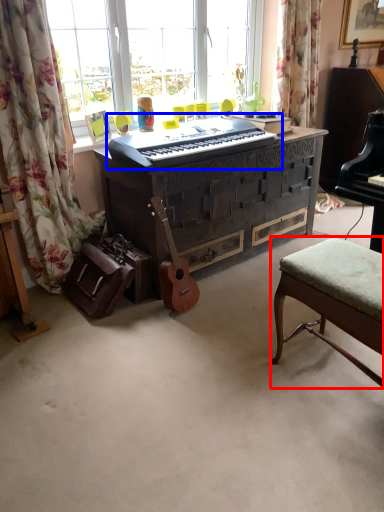
Question: Among these objects, which one is nearest to the camera, stool (highlighted by a red box) or musical keyboard (highlighted by a blue box)?

Choices:
 (A) stool
 (B) musical keyboard

Answer: (A)